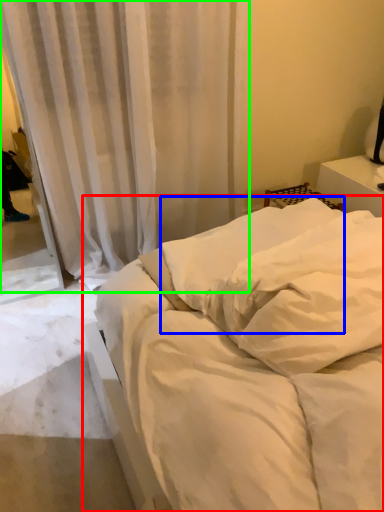
Question: Which object is positioned farthest from bed (highlighted by a red box)? Select from pillow (highlighted by a blue box) and curtain (highlighted by a green box).

Choices:
 (A) pillow
 (B) curtain

Answer: (B)